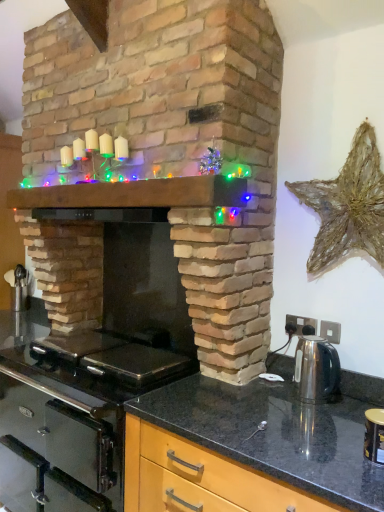
Question: Should I look upward or downward to see brick fireplace at center?

Choices:
 (A) up
 (B) down

Answer: (A)

Question: Is satin silver kettle at right located outside brick fireplace at center?

Choices:
 (A) yes
 (B) no

Answer: (A)

Question: Considering the relative positions of satin silver kettle at right and brick fireplace at center in the image provided, is satin silver kettle at right to the right of brick fireplace at center from the viewer's perspective?

Choices:
 (A) yes
 (B) no

Answer: (A)

Question: Does satin silver kettle at right appear on the left side of brick fireplace at center?

Choices:
 (A) yes
 (B) no

Answer: (B)

Question: Can you confirm if satin silver kettle at right is shorter than brick fireplace at center?

Choices:
 (A) yes
 (B) no

Answer: (A)

Question: Can you confirm if satin silver kettle at right is taller than brick fireplace at center?

Choices:
 (A) no
 (B) yes

Answer: (A)

Question: From the image's perspective, would you say satin silver kettle at right is positioned over brick fireplace at center?

Choices:
 (A) no
 (B) yes

Answer: (A)

Question: Is brick fireplace at center not within wooden mantel at center?

Choices:
 (A) yes
 (B) no

Answer: (A)

Question: Considering the relative positions of brick fireplace at center and wooden mantel at center in the image provided, is brick fireplace at center to the left of wooden mantel at center from the viewer's perspective?

Choices:
 (A) no
 (B) yes

Answer: (A)

Question: From the image's perspective, is brick fireplace at center below wooden mantel at center?

Choices:
 (A) yes
 (B) no

Answer: (B)

Question: Is brick fireplace at center at the right side of wooden mantel at center?

Choices:
 (A) yes
 (B) no

Answer: (A)

Question: Is brick fireplace at center with wooden mantel at center?

Choices:
 (A) no
 (B) yes

Answer: (A)

Question: Is brick fireplace at center turned away from wooden mantel at center?

Choices:
 (A) yes
 (B) no

Answer: (A)

Question: Considering the relative positions of brick fireplace at center and matte black countertop at lower right in the image provided, is brick fireplace at center in front of matte black countertop at lower right?

Choices:
 (A) yes
 (B) no

Answer: (B)